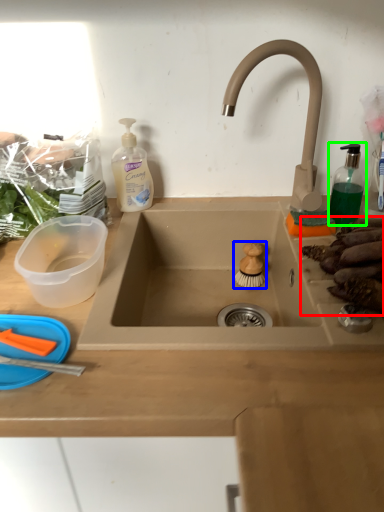
Question: Which is farther away from food (highlighted by a red box)? food (highlighted by a blue box) or soap dispenser (highlighted by a green box)?

Choices:
 (A) food
 (B) soap dispenser

Answer: (A)